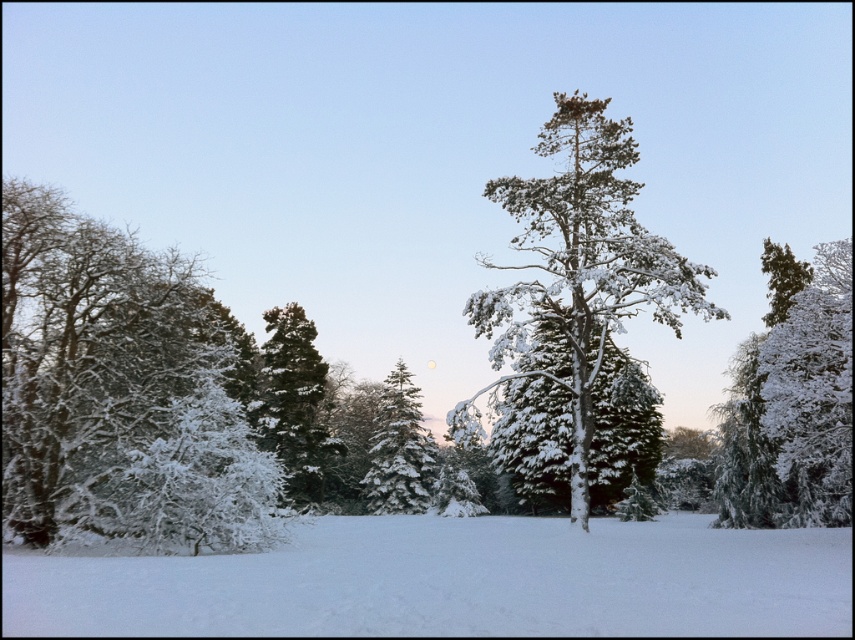
Locate an element on the screen. snow-covered pine tree at center is located at coordinates (578, 269).

Which is in front, point (688, 305) or point (390, 513)?

Positioned in front is point (688, 305).

The height and width of the screenshot is (640, 855). What are the coordinates of `snow-covered pine tree at center` in the screenshot? It's located at (578, 269).

Based on the photo, can you confirm if white fluffy snow at center is positioned to the right of green matte tree at center?

Indeed, white fluffy snow at center is positioned on the right side of green matte tree at center.

Based on the photo, how distant is white fluffy snow at center from green matte tree at center?

A distance of 101.30 feet exists between white fluffy snow at center and green matte tree at center.

Between point (519, 589) and point (314, 392), which one is positioned behind?

The point (314, 392) is more distant.

The width and height of the screenshot is (855, 640). In order to click on white fluffy snow at center in this screenshot , I will do `click(453, 582)`.

Does white snow-covered tree at right appear under snow-covered evergreen at center?

No, white snow-covered tree at right is not below snow-covered evergreen at center.

Does white snow-covered tree at right appear on the left side of snow-covered evergreen at center?

In fact, white snow-covered tree at right is to the right of snow-covered evergreen at center.

This screenshot has height=640, width=855. I want to click on white snow-covered tree at right, so click(812, 394).